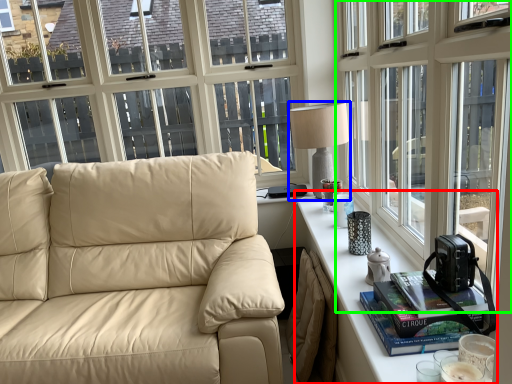
Question: Considering the real-world distances, which object is closest to table (highlighted by a red box)? table lamp (highlighted by a blue box) or window (highlighted by a green box).

Choices:
 (A) table lamp
 (B) window

Answer: (B)